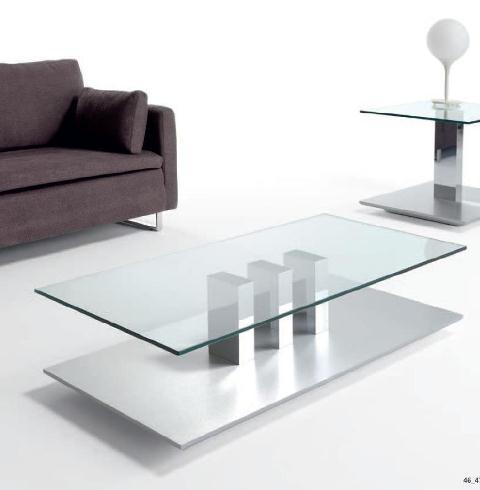
This screenshot has height=490, width=480. Find the location of `lamp`. lamp is located at coordinates (452, 44).